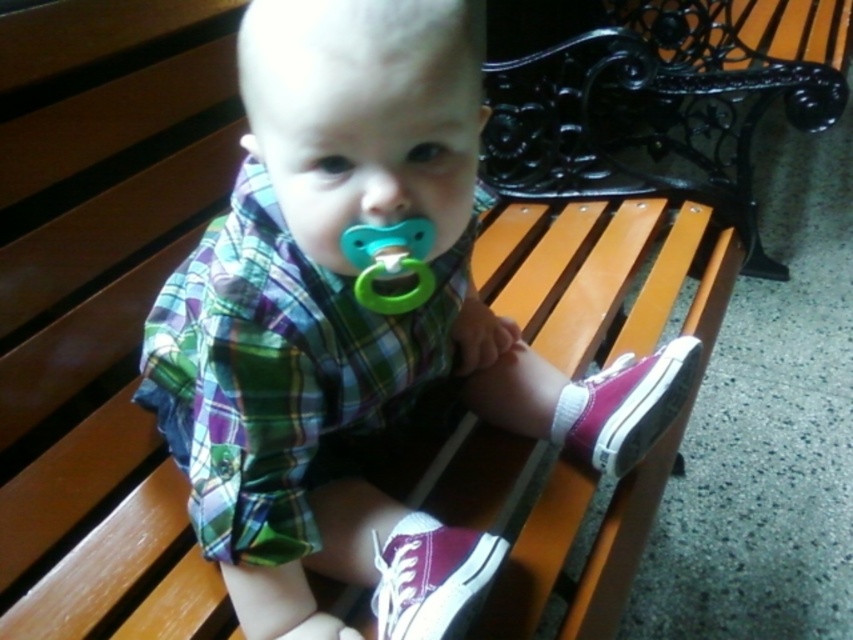
Question: Which point is closer to the camera?

Choices:
 (A) green rubber pacifier at center
 (B) plaid fabric shirt at center

Answer: (B)

Question: Can you confirm if plaid fabric shirt at center is positioned above green rubber pacifier at center?

Choices:
 (A) no
 (B) yes

Answer: (A)

Question: Is plaid fabric shirt at center thinner than green rubber pacifier at center?

Choices:
 (A) yes
 (B) no

Answer: (B)

Question: Does plaid fabric shirt at center have a smaller size compared to green rubber pacifier at center?

Choices:
 (A) yes
 (B) no

Answer: (B)